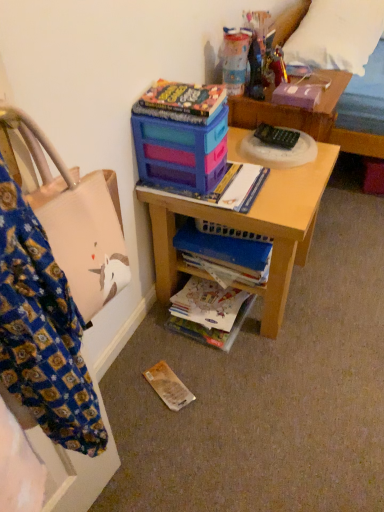
Question: Should I look upward or downward to see black plastic remote control at center?

Choices:
 (A) up
 (B) down

Answer: (A)

Question: Considering the relative positions of matte paper book at lower center, which appears as the first book when ordered from the bottom, and blue matte book at center, the 2th book positioned from the bottom, in the image provided, is matte paper book at lower center, which appears as the first book when ordered from the bottom, in front of blue matte book at center, the 2th book positioned from the bottom,?

Choices:
 (A) yes
 (B) no

Answer: (B)

Question: Does matte paper book at lower center, which appears as the first book when ordered from the bottom, have a greater width compared to blue matte book at center, the 2th book positioned from the bottom?

Choices:
 (A) yes
 (B) no

Answer: (B)

Question: Is matte paper book at lower center, which is the 2th book from top to bottom, aimed at blue matte book at center, the 2th book positioned from the bottom?

Choices:
 (A) yes
 (B) no

Answer: (B)

Question: From a real-world perspective, is matte paper book at lower center, which is the 2th book from top to bottom, physically above blue matte book at center, the 2th book positioned from the bottom?

Choices:
 (A) yes
 (B) no

Answer: (B)

Question: Is matte paper book at lower center, which appears as the first book when ordered from the bottom, oriented away from blue matte book at center, marked as the first book in a top-to-bottom arrangement?

Choices:
 (A) no
 (B) yes

Answer: (A)

Question: Considering the relative sizes of matte paper book at lower center, which appears as the first book when ordered from the bottom, and blue matte book at center, marked as the first book in a top-to-bottom arrangement, in the image provided, is matte paper book at lower center, which appears as the first book when ordered from the bottom, smaller than blue matte book at center, marked as the first book in a top-to-bottom arrangement,?

Choices:
 (A) no
 (B) yes

Answer: (B)

Question: From the image's perspective, would you say translucent plastic container at upper center, marked as the second toy in a right-to-left arrangement, is shown under matte plastic magazine at center?

Choices:
 (A) no
 (B) yes

Answer: (A)

Question: Is translucent plastic container at upper center, the 1th toy in the left-to-right sequence, behind matte plastic magazine at center?

Choices:
 (A) yes
 (B) no

Answer: (A)

Question: Can you confirm if translucent plastic container at upper center, the 1th toy in the left-to-right sequence, is wider than matte plastic magazine at center?

Choices:
 (A) no
 (B) yes

Answer: (A)

Question: Can you confirm if translucent plastic container at upper center, marked as the second toy in a right-to-left arrangement, is taller than matte plastic magazine at center?

Choices:
 (A) no
 (B) yes

Answer: (B)

Question: Are translucent plastic container at upper center, the 1th toy in the left-to-right sequence, and matte plastic magazine at center beside each other?

Choices:
 (A) no
 (B) yes

Answer: (A)

Question: Can you confirm if translucent plastic container at upper center, the 1th toy in the left-to-right sequence, is bigger than matte plastic magazine at center?

Choices:
 (A) yes
 (B) no

Answer: (B)

Question: Is matte plastic toy box at upper center aimed at white soft pillow at upper right?

Choices:
 (A) yes
 (B) no

Answer: (B)